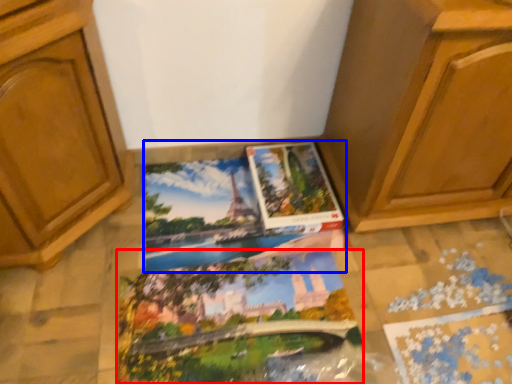
Question: Which point is closer to the camera, coloring book (highlighted by a red box) or coloring book (highlighted by a blue box)?

Choices:
 (A) coloring book
 (B) coloring book

Answer: (A)